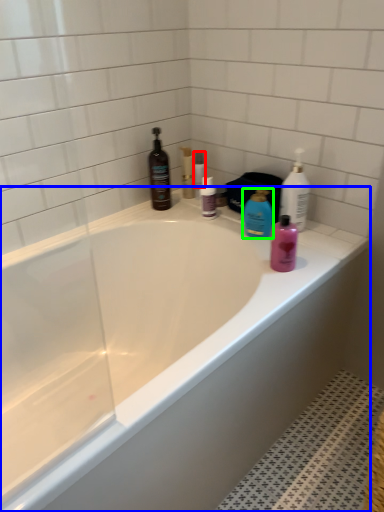
Question: Based on their relative distances, which object is nearer to toiletry (highlighted by a red box)? Choose from bathtub (highlighted by a blue box) and cleaning product (highlighted by a green box).

Choices:
 (A) bathtub
 (B) cleaning product

Answer: (B)